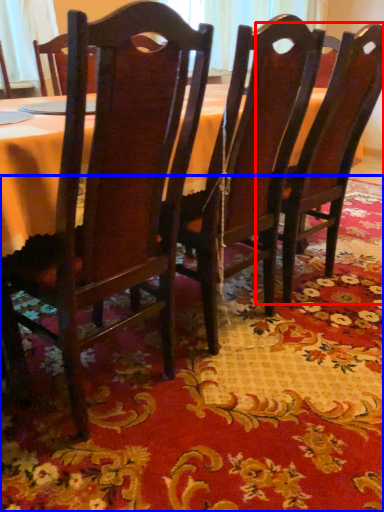
Question: Among these objects, which one is farthest to the camera, chair (highlighted by a red box) or place mat (highlighted by a blue box)?

Choices:
 (A) chair
 (B) place mat

Answer: (A)